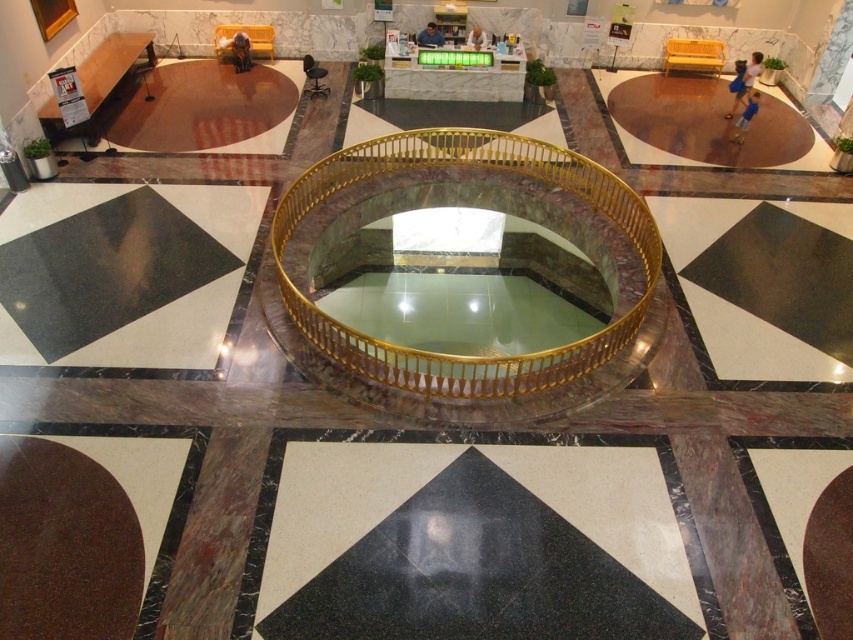
Which of these two, brown polished wood floor at upper right or brown polished stone atrium at upper left, stands shorter?

With less height is brown polished stone atrium at upper left.

Is brown polished wood floor at upper right wider than brown polished stone atrium at upper left?

Indeed, brown polished wood floor at upper right has a greater width compared to brown polished stone atrium at upper left.

Is point (798, 134) farther from viewer compared to point (263, 147)?

That is True.

The height and width of the screenshot is (640, 853). Identify the location of brown polished wood floor at upper right. (703, 124).

Locate an element on the screen. black marble floor at lower right is located at coordinates (764, 284).

Does black marble floor at lower right have a lesser width compared to brown polished stone circle at lower left?

No.

The image size is (853, 640). Describe the element at coordinates (764, 284) in the screenshot. I see `black marble floor at lower right` at that location.

You are a GUI agent. You are given a task and a screenshot of the screen. Output one action in this format:
    pyautogui.click(x=<x>, y=<y>)
    Task: Click on the black marble floor at lower right
    This screenshot has height=640, width=853.
    Given the screenshot: What is the action you would take?
    pyautogui.click(x=764, y=284)

Can you confirm if black marble atrium at lower center is shorter than black marble floor at lower right?

Correct, black marble atrium at lower center is not as tall as black marble floor at lower right.

The height and width of the screenshot is (640, 853). What do you see at coordinates (473, 545) in the screenshot?
I see `black marble atrium at lower center` at bounding box center [473, 545].

Image resolution: width=853 pixels, height=640 pixels. In order to click on black marble atrium at lower center in this screenshot , I will do `click(473, 545)`.